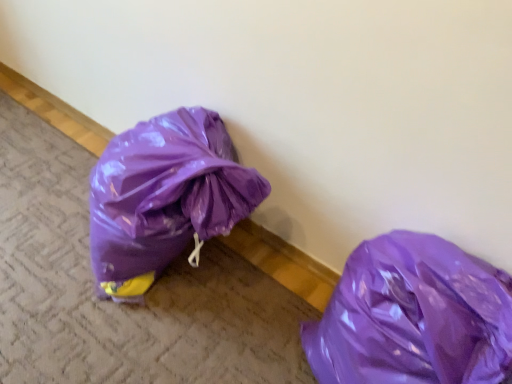
Question: In terms of width, does glossy plastic bag at lower left look wider or thinner when compared to glossy plastic bag at lower right?

Choices:
 (A) thin
 (B) wide

Answer: (B)

Question: Considering their positions, is glossy plastic bag at lower left located in front of or behind glossy plastic bag at lower right?

Choices:
 (A) behind
 (B) front

Answer: (A)

Question: From the image's perspective, is glossy plastic bag at lower left located above or below glossy plastic bag at lower right?

Choices:
 (A) above
 (B) below

Answer: (A)

Question: From the image's perspective, is glossy plastic bag at lower right located above or below glossy plastic bag at lower left?

Choices:
 (A) below
 (B) above

Answer: (A)

Question: Looking at the image, does glossy plastic bag at lower right seem bigger or smaller compared to glossy plastic bag at lower left?

Choices:
 (A) big
 (B) small

Answer: (A)

Question: In terms of height, does glossy plastic bag at lower right look taller or shorter compared to glossy plastic bag at lower left?

Choices:
 (A) tall
 (B) short

Answer: (A)

Question: Choose the correct answer: Is glossy plastic bag at lower right inside glossy plastic bag at lower left or outside it?

Choices:
 (A) outside
 (B) inside

Answer: (A)